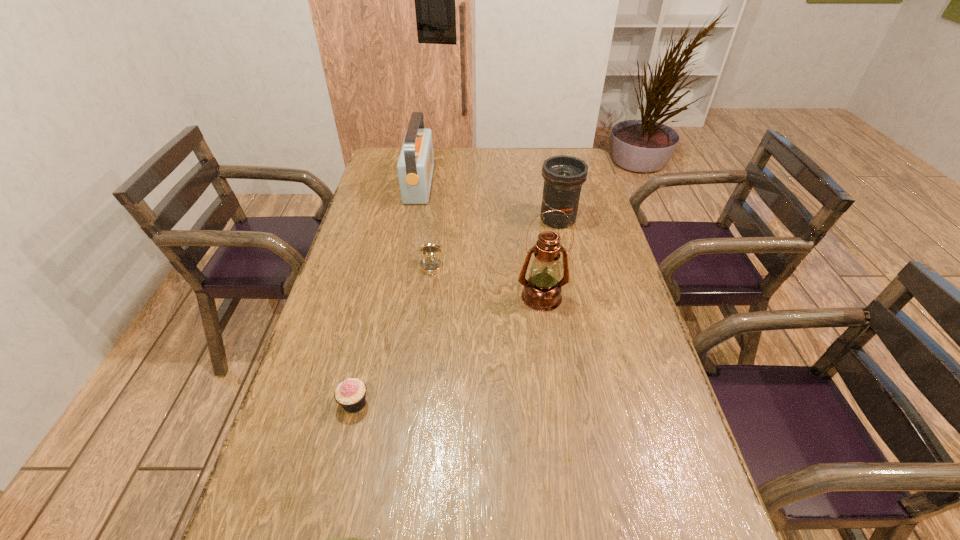
Find the location of `vacant space situated on the right of the cupcake`. vacant space situated on the right of the cupcake is located at coordinates (426, 403).

Locate an element on the screen. free space located 0.070m with the dial facing the compass is located at coordinates (428, 294).

Identify the location of object that is at the far edge. The height and width of the screenshot is (540, 960). (415, 165).

I want to click on radio receiver present at the left edge, so click(x=415, y=165).

Find the location of a particular element. The height and width of the screenshot is (540, 960). cupcake that is positioned at the left edge is located at coordinates (350, 394).

Find the location of a particular element. object that is at the right edge is located at coordinates (563, 175).

Where is `object present at the far left corner`? object present at the far left corner is located at coordinates (415, 165).

Where is `vacant space at the far edge of the desktop`? The height and width of the screenshot is (540, 960). vacant space at the far edge of the desktop is located at coordinates (486, 154).

The height and width of the screenshot is (540, 960). In the image, there is a desktop. Identify the location of vacant area at the left edge. (391, 218).

In the image, there is a desktop. Find the location of `vacant space at the right edge`. vacant space at the right edge is located at coordinates (604, 250).